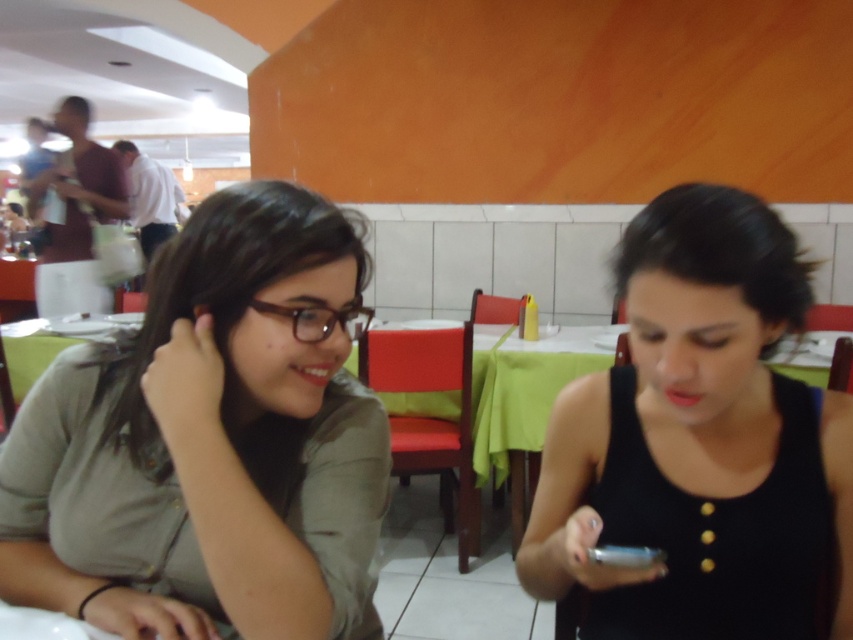
Question: Does matte green shirt at left appear on the left side of black matte tank top at center?

Choices:
 (A) no
 (B) yes

Answer: (B)

Question: Is matte green shirt at left behind black matte tank top at center?

Choices:
 (A) no
 (B) yes

Answer: (A)

Question: Is matte green shirt at left positioned before black matte tank top at center?

Choices:
 (A) no
 (B) yes

Answer: (B)

Question: Which of the following is the closest to the observer?

Choices:
 (A) black matte tank top at center
 (B) matte green shirt at left

Answer: (B)